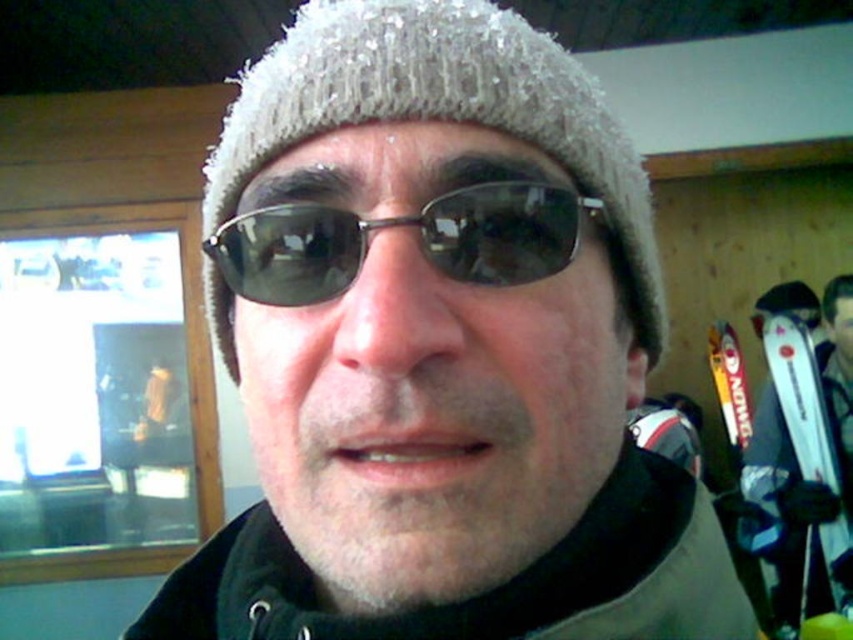
Who is shorter, sunglasses at center or white glossy ski at right?

Standing shorter between the two is sunglasses at center.

Is sunglasses at center behind white glossy ski at right?

No, it is in front of white glossy ski at right.

This screenshot has height=640, width=853. What do you see at coordinates (402, 225) in the screenshot?
I see `sunglasses at center` at bounding box center [402, 225].

Find the location of `sunglasses at center`. sunglasses at center is located at coordinates (402, 225).